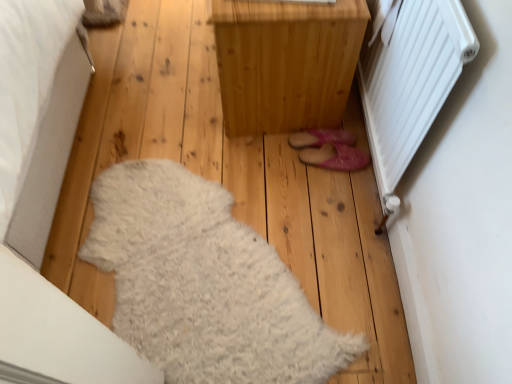
The image size is (512, 384). What are the coordinates of `natural wood cabinet at center` in the screenshot? It's located at (286, 62).

Considering the sizes of objects pink fuzzy slippers at center and natural wood cabinet at center in the image provided, who is thinner, pink fuzzy slippers at center or natural wood cabinet at center?

With smaller width is pink fuzzy slippers at center.

How far apart are pink fuzzy slippers at center and natural wood cabinet at center?

pink fuzzy slippers at center and natural wood cabinet at center are 10.02 inches apart.

Is pink fuzzy slippers at center behind natural wood cabinet at center?

Yes, pink fuzzy slippers at center is behind natural wood cabinet at center.

Would you say pink fuzzy slippers at center is outside natural wood cabinet at center?

pink fuzzy slippers at center is positioned outside natural wood cabinet at center.

Is point (314, 65) more distant than point (328, 156)?

That is False.

From the image's perspective, is natural wood cabinet at center located above or below pink fuzzy slippers at center?

Clearly, from the image's perspective, natural wood cabinet at center is above pink fuzzy slippers at center.

Is natural wood cabinet at center not within pink fuzzy slippers at center?

Yes, natural wood cabinet at center is not within pink fuzzy slippers at center.

Considering the sizes of natural wood cabinet at center and pink fuzzy slippers at center in the image, is natural wood cabinet at center taller or shorter than pink fuzzy slippers at center?

Considering their sizes, natural wood cabinet at center has more height than pink fuzzy slippers at center.

Is the depth of white fluffy rug at lower left greater than that of pink fuzzy slippers at center?

No, the depth of white fluffy rug at lower left is less than that of pink fuzzy slippers at center.

Is white fluffy rug at lower left positioned with its back to pink fuzzy slippers at center?

No, white fluffy rug at lower left is not facing away from pink fuzzy slippers at center.

Is white fluffy rug at lower left directly adjacent to pink fuzzy slippers at center?

No, white fluffy rug at lower left is not beside pink fuzzy slippers at center.

From the image's perspective, is natural wood cabinet at center above or below white fluffy rug at lower left?

Clearly, from the image's perspective, natural wood cabinet at center is above white fluffy rug at lower left.

Between natural wood cabinet at center and white fluffy rug at lower left, which one has larger width?

white fluffy rug at lower left.

Is natural wood cabinet at center oriented towards white fluffy rug at lower left?

No, natural wood cabinet at center is not turned towards white fluffy rug at lower left.

Locate an element on the screen. The width and height of the screenshot is (512, 384). furniture above the white fluffy rug at lower left (from a real-world perspective) is located at coordinates pyautogui.click(x=286, y=62).

Which is in front, point (258, 235) or point (345, 74)?

The point (258, 235) is closer to the camera.

From a real-world perspective, who is located lower, white fluffy rug at lower left or natural wood cabinet at center?

white fluffy rug at lower left.

Is white fluffy rug at lower left to the right of natural wood cabinet at center from the viewer's perspective?

In fact, white fluffy rug at lower left is to the left of natural wood cabinet at center.

This screenshot has height=384, width=512. I want to click on furniture above the white fluffy rug at lower left (from a real-world perspective), so click(286, 62).

Is pink fuzzy slippers at center next to white fluffy rug at lower left?

No, pink fuzzy slippers at center is not making contact with white fluffy rug at lower left.

Which object is thinner, pink fuzzy slippers at center or white fluffy rug at lower left?

Thinner between the two is pink fuzzy slippers at center.

Between pink fuzzy slippers at center and white fluffy rug at lower left, which one is positioned behind?

pink fuzzy slippers at center is behind.

The width and height of the screenshot is (512, 384). I want to click on footwear behind the natural wood cabinet at center, so click(x=329, y=149).

Identify the location of footwear below the natural wood cabinet at center (from the image's perspective). This screenshot has height=384, width=512. (329, 149).

Based on the photo, when comparing their distances from natural wood cabinet at center, does pink fuzzy slippers at center or white fluffy rug at lower left seem closer?

Based on the image, pink fuzzy slippers at center appears to be nearer to natural wood cabinet at center.

Which object lies further to the anchor point pink fuzzy slippers at center, white fluffy rug at lower left or natural wood cabinet at center?

white fluffy rug at lower left lies further to pink fuzzy slippers at center than the other object.

Looking at the image, which one is located closer to natural wood cabinet at center, white fluffy rug at lower left or pink fuzzy slippers at center?

Among the two, pink fuzzy slippers at center is located nearer to natural wood cabinet at center.

Considering their positions, is natural wood cabinet at center positioned closer to pink fuzzy slippers at center than white fluffy rug at lower left?

Among the two, natural wood cabinet at center is located nearer to pink fuzzy slippers at center.

Considering their positions, is natural wood cabinet at center positioned closer to white fluffy rug at lower left than pink fuzzy slippers at center?

natural wood cabinet at center is positioned closer to the anchor white fluffy rug at lower left.

When comparing their distances from white fluffy rug at lower left, does pink fuzzy slippers at center or natural wood cabinet at center seem closer?

natural wood cabinet at center is closer to white fluffy rug at lower left.

Find the location of a particular element. footwear between natural wood cabinet at center and white fluffy rug at lower left from top to bottom is located at coordinates (329, 149).